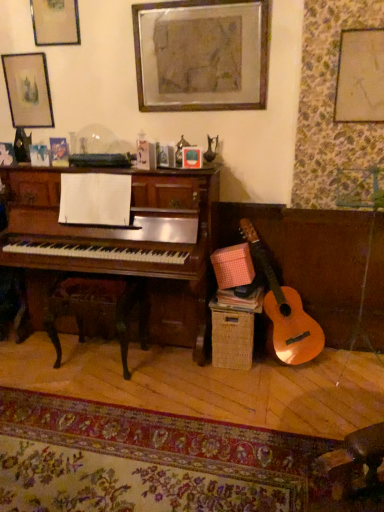
This screenshot has width=384, height=512. What are the coordinates of `matte glass picture frame at upper center, arranged as the third picture frame when viewed from the right` in the screenshot? It's located at coord(192,157).

The height and width of the screenshot is (512, 384). Find the location of `matte gold picture frame at upper right, the fifth picture frame when ordered from left to right`. matte gold picture frame at upper right, the fifth picture frame when ordered from left to right is located at coordinates (360, 76).

This screenshot has width=384, height=512. Describe the element at coordinates (360, 76) in the screenshot. I see `matte gold picture frame at upper right, the fifth picture frame when ordered from left to right` at that location.

Find the location of a particular element. matte black picture frame at upper left, which appears as the 5th picture frame when viewed from the right is located at coordinates (28, 90).

How much distance is there between matte gold picture frame at upper left, the 4th picture frame when ordered from right to left, and matte gold picture frame at upper right, which is counted as the first picture frame, starting from the right?

matte gold picture frame at upper left, the 4th picture frame when ordered from right to left, is 5.78 feet from matte gold picture frame at upper right, which is counted as the first picture frame, starting from the right.

Consider the image. Is matte gold picture frame at upper left, positioned as the 2th picture frame in left-to-right order, wider than matte gold picture frame at upper right, which is counted as the first picture frame, starting from the right?

No.

Is matte gold picture frame at upper left, the 4th picture frame when ordered from right to left, oriented towards matte gold picture frame at upper right, the fifth picture frame when ordered from left to right?

No, matte gold picture frame at upper left, the 4th picture frame when ordered from right to left, is not facing towards matte gold picture frame at upper right, the fifth picture frame when ordered from left to right.

Would you say matte gold picture frame at upper left, positioned as the 2th picture frame in left-to-right order, is inside or outside matte gold picture frame at upper right, the fifth picture frame when ordered from left to right?

matte gold picture frame at upper left, positioned as the 2th picture frame in left-to-right order, is not inside matte gold picture frame at upper right, the fifth picture frame when ordered from left to right, it's outside.

Are matte glass picture frame at upper center, which appears as the 3th picture frame when viewed from the left, and matte black picture frame at upper left, positioned as the 1th picture frame in left-to-right order, beside each other?

No, matte glass picture frame at upper center, which appears as the 3th picture frame when viewed from the left, is not with matte black picture frame at upper left, positioned as the 1th picture frame in left-to-right order.

In the scene shown: From a real-world perspective, between matte glass picture frame at upper center, arranged as the third picture frame when viewed from the right, and matte black picture frame at upper left, which appears as the 5th picture frame when viewed from the right, who is vertically lower?

matte glass picture frame at upper center, arranged as the third picture frame when viewed from the right.

In the image, is matte glass picture frame at upper center, which appears as the 3th picture frame when viewed from the left, positioned in front of or behind matte black picture frame at upper left, which appears as the 5th picture frame when viewed from the right?

Clearly, matte glass picture frame at upper center, which appears as the 3th picture frame when viewed from the left, is in front of matte black picture frame at upper left, which appears as the 5th picture frame when viewed from the right.

Between matte glass picture frame at upper center, which appears as the 3th picture frame when viewed from the left, and matte black picture frame at upper left, positioned as the 1th picture frame in left-to-right order, which one has less height?

matte glass picture frame at upper center, which appears as the 3th picture frame when viewed from the left.

Between matte glass picture frame at upper center, which appears as the 3th picture frame when viewed from the left, and matte gold picture frame at upper left, the 4th picture frame when ordered from right to left, which one has less height?

Standing shorter between the two is matte glass picture frame at upper center, which appears as the 3th picture frame when viewed from the left.

Which of these two, matte glass picture frame at upper center, arranged as the third picture frame when viewed from the right, or matte gold picture frame at upper left, positioned as the 2th picture frame in left-to-right order, is bigger?

matte gold picture frame at upper left, positioned as the 2th picture frame in left-to-right order.

From a real-world perspective, is matte glass picture frame at upper center, which appears as the 3th picture frame when viewed from the left, positioned under matte gold picture frame at upper left, the 4th picture frame when ordered from right to left, based on gravity?

Yes, from a real-world perspective, matte glass picture frame at upper center, which appears as the 3th picture frame when viewed from the left, is below matte gold picture frame at upper left, the 4th picture frame when ordered from right to left.

Can matte black picture frame at upper left, positioned as the 1th picture frame in left-to-right order, be found inside wooden picture frame at upper center, which appears as the fourth picture frame when viewed from the left?

Actually, matte black picture frame at upper left, positioned as the 1th picture frame in left-to-right order, is outside wooden picture frame at upper center, which appears as the fourth picture frame when viewed from the left.

Is point (236, 28) in front of point (39, 79)?

Yes, it is.

Find the location of `the 3rd picture frame behind the wooden picture frame at upper center, which appears as the fourth picture frame when viewed from the left`. the 3rd picture frame behind the wooden picture frame at upper center, which appears as the fourth picture frame when viewed from the left is located at coordinates (28, 90).

How distant is wooden picture frame at upper center, which appears as the fourth picture frame when viewed from the left, from matte glass picture frame at upper center, which appears as the 3th picture frame when viewed from the left?

wooden picture frame at upper center, which appears as the fourth picture frame when viewed from the left, is 23.47 inches away from matte glass picture frame at upper center, which appears as the 3th picture frame when viewed from the left.

From the image's perspective, is wooden picture frame at upper center, marked as the 2th picture frame in a right-to-left arrangement, over matte glass picture frame at upper center, arranged as the third picture frame when viewed from the right?

Correct, wooden picture frame at upper center, marked as the 2th picture frame in a right-to-left arrangement, appears higher than matte glass picture frame at upper center, arranged as the third picture frame when viewed from the right, in the image.

Does wooden picture frame at upper center, which appears as the fourth picture frame when viewed from the left, have a larger size compared to matte glass picture frame at upper center, which appears as the 3th picture frame when viewed from the left?

Yes, wooden picture frame at upper center, which appears as the fourth picture frame when viewed from the left, is bigger than matte glass picture frame at upper center, which appears as the 3th picture frame when viewed from the left.

Is wooden picture frame at upper center, marked as the 2th picture frame in a right-to-left arrangement, at the right side of matte glass picture frame at upper center, arranged as the third picture frame when viewed from the right?

Yes.

Is matte black picture frame at upper left, positioned as the 1th picture frame in left-to-right order, looking in the opposite direction of wooden rocking chair at lower left?

No, matte black picture frame at upper left, positioned as the 1th picture frame in left-to-right order, is not facing away from wooden rocking chair at lower left.

From the image's perspective, is matte black picture frame at upper left, positioned as the 1th picture frame in left-to-right order, located beneath wooden rocking chair at lower left?

No, from the image's perspective, matte black picture frame at upper left, positioned as the 1th picture frame in left-to-right order, is not beneath wooden rocking chair at lower left.

Is matte black picture frame at upper left, which appears as the 5th picture frame when viewed from the right, to the left or to the right of wooden rocking chair at lower left in the image?

From the image, it's evident that matte black picture frame at upper left, which appears as the 5th picture frame when viewed from the right, is to the left of wooden rocking chair at lower left.

Which point is more forward, (36,67) or (50,311)?

The point (50,311) is in front.

How many degrees apart are the facing directions of wooden picture frame at upper center, which appears as the fourth picture frame when viewed from the left, and matte gold picture frame at upper right, which is counted as the first picture frame, starting from the right?

The angle between the facing direction of wooden picture frame at upper center, which appears as the fourth picture frame when viewed from the left, and the facing direction of matte gold picture frame at upper right, which is counted as the first picture frame, starting from the right, is 0.275 degrees.

Can you confirm if wooden picture frame at upper center, which appears as the fourth picture frame when viewed from the left, is wider than matte gold picture frame at upper right, which is counted as the first picture frame, starting from the right?

Yes.

Is wooden picture frame at upper center, marked as the 2th picture frame in a right-to-left arrangement, next to matte gold picture frame at upper right, the fifth picture frame when ordered from left to right, and touching it?

No, wooden picture frame at upper center, marked as the 2th picture frame in a right-to-left arrangement, is not in contact with matte gold picture frame at upper right, the fifth picture frame when ordered from left to right.

From a real-world perspective, which is physically above, wooden picture frame at upper center, which appears as the fourth picture frame when viewed from the left, or matte gold picture frame at upper right, the fifth picture frame when ordered from left to right?

wooden picture frame at upper center, which appears as the fourth picture frame when viewed from the left, from a real-world perspective.

The height and width of the screenshot is (512, 384). I want to click on picture frame that is the 2nd one above the matte gold picture frame at upper right, which is counted as the first picture frame, starting from the right (from a real-world perspective), so tap(55, 22).

The width and height of the screenshot is (384, 512). In order to click on picture frame below the matte black picture frame at upper left, which appears as the 5th picture frame when viewed from the right (from a real-world perspective) in this screenshot , I will do click(192, 157).

Based on the photo, considering their positions, is matte glass picture frame at upper center, which appears as the 3th picture frame when viewed from the left, positioned further to matte gold picture frame at upper right, which is counted as the first picture frame, starting from the right, than wooden rocking chair at lower left?

Based on the image, wooden rocking chair at lower left appears to be further to matte gold picture frame at upper right, which is counted as the first picture frame, starting from the right.

Estimate the real-world distances between objects in this image. Which object is closer to matte black picture frame at upper left, which appears as the 5th picture frame when viewed from the right, matte gold picture frame at upper left, the 4th picture frame when ordered from right to left, or matte glass picture frame at upper center, which appears as the 3th picture frame when viewed from the left?

The object closer to matte black picture frame at upper left, which appears as the 5th picture frame when viewed from the right, is matte gold picture frame at upper left, the 4th picture frame when ordered from right to left.

Which object lies further to the anchor point wooden rocking chair at lower left, matte gold picture frame at upper left, the 4th picture frame when ordered from right to left, or matte black picture frame at upper left, positioned as the 1th picture frame in left-to-right order?

Based on the image, matte gold picture frame at upper left, the 4th picture frame when ordered from right to left, appears to be further to wooden rocking chair at lower left.

Based on their spatial positions, is matte black picture frame at upper left, positioned as the 1th picture frame in left-to-right order, or wooden picture frame at upper center, which appears as the fourth picture frame when viewed from the left, closer to wooden rocking chair at lower left?

Among the two, matte black picture frame at upper left, positioned as the 1th picture frame in left-to-right order, is located nearer to wooden rocking chair at lower left.

When comparing their distances from wooden rocking chair at lower left, does matte black picture frame at upper left, which appears as the 5th picture frame when viewed from the right, or matte gold picture frame at upper right, which is counted as the first picture frame, starting from the right, seem further?

matte gold picture frame at upper right, which is counted as the first picture frame, starting from the right.

From the picture: When comparing their distances from matte glass picture frame at upper center, which appears as the 3th picture frame when viewed from the left, does matte gold picture frame at upper right, the fifth picture frame when ordered from left to right, or wooden rocking chair at lower left seem further?

wooden rocking chair at lower left lies further to matte glass picture frame at upper center, which appears as the 3th picture frame when viewed from the left, than the other object.

Considering their positions, is matte black picture frame at upper left, positioned as the 1th picture frame in left-to-right order, positioned closer to matte gold picture frame at upper left, the 4th picture frame when ordered from right to left, than wooden picture frame at upper center, which appears as the fourth picture frame when viewed from the left?

matte black picture frame at upper left, positioned as the 1th picture frame in left-to-right order.

When comparing their distances from wooden picture frame at upper center, which appears as the fourth picture frame when viewed from the left, does wooden rocking chair at lower left or matte gold picture frame at upper left, positioned as the 2th picture frame in left-to-right order, seem further?

Based on the image, wooden rocking chair at lower left appears to be further to wooden picture frame at upper center, which appears as the fourth picture frame when viewed from the left.

Find the location of a particular element. This screenshot has width=384, height=512. picture frame between matte gold picture frame at upper left, the 4th picture frame when ordered from right to left, and wooden picture frame at upper center, marked as the 2th picture frame in a right-to-left arrangement, in the horizontal direction is located at coordinates (192, 157).

The width and height of the screenshot is (384, 512). Identify the location of rocking chair between matte black picture frame at upper left, positioned as the 1th picture frame in left-to-right order, and matte gold picture frame at upper right, which is counted as the first picture frame, starting from the right, from left to right. (98, 308).

Where is `picture frame situated between matte glass picture frame at upper center, which appears as the 3th picture frame when viewed from the left, and matte gold picture frame at upper right, the fifth picture frame when ordered from left to right, from left to right`? The height and width of the screenshot is (512, 384). picture frame situated between matte glass picture frame at upper center, which appears as the 3th picture frame when viewed from the left, and matte gold picture frame at upper right, the fifth picture frame when ordered from left to right, from left to right is located at coordinates (202, 55).

This screenshot has height=512, width=384. I want to click on picture frame situated between matte black picture frame at upper left, which appears as the 5th picture frame when viewed from the right, and matte glass picture frame at upper center, arranged as the third picture frame when viewed from the right, from left to right, so click(55, 22).